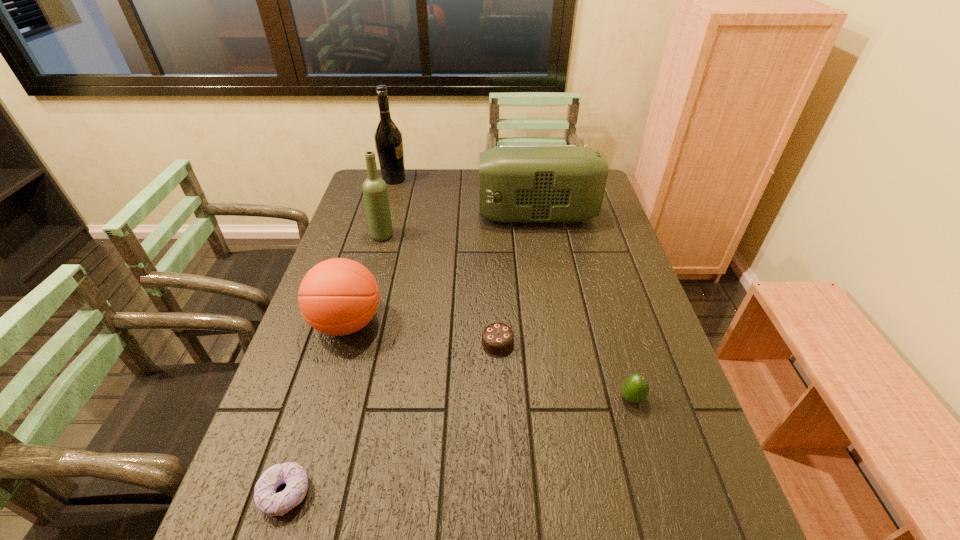
The width and height of the screenshot is (960, 540). I want to click on object present at the far edge, so [388, 138].

The height and width of the screenshot is (540, 960). Identify the location of basketball positioned at the left edge. (339, 296).

This screenshot has width=960, height=540. Find the location of `doughnut at the left edge`. doughnut at the left edge is located at coordinates (266, 499).

Find the location of a particular element. The width and height of the screenshot is (960, 540). radio_receiver positioned at the right edge is located at coordinates (517, 183).

Find the location of a particular element. avocado situated at the right edge is located at coordinates (634, 388).

At what (x,y) coordinates should I click in order to perform the action: click on object located in the far left corner section of the desktop. Please return your answer as a coordinate pair (x, y). Looking at the image, I should click on (388, 138).

At what (x,y) coordinates should I click in order to perform the action: click on vacant region at the left edge of the desktop. Please return your answer as a coordinate pair (x, y). Looking at the image, I should click on (351, 353).

The height and width of the screenshot is (540, 960). What are the coordinates of `free space at the right edge of the desktop` in the screenshot? It's located at (599, 218).

At what (x,y) coordinates should I click in order to perform the action: click on blank space at the far left corner of the desktop. Please return your answer as a coordinate pair (x, y). The image size is (960, 540). Looking at the image, I should click on (356, 198).

Where is `vacant space that's between the shortest object and the avocado`? The image size is (960, 540). vacant space that's between the shortest object and the avocado is located at coordinates (458, 446).